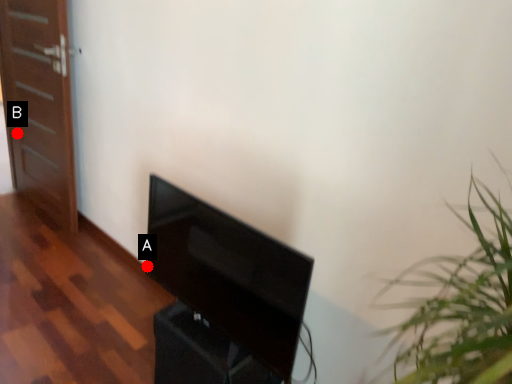
Question: Two points are circled on the image, labeled by A and B beside each circle. Which point is farther to the camera?

Choices:
 (A) A is further
 (B) B is further

Answer: (B)